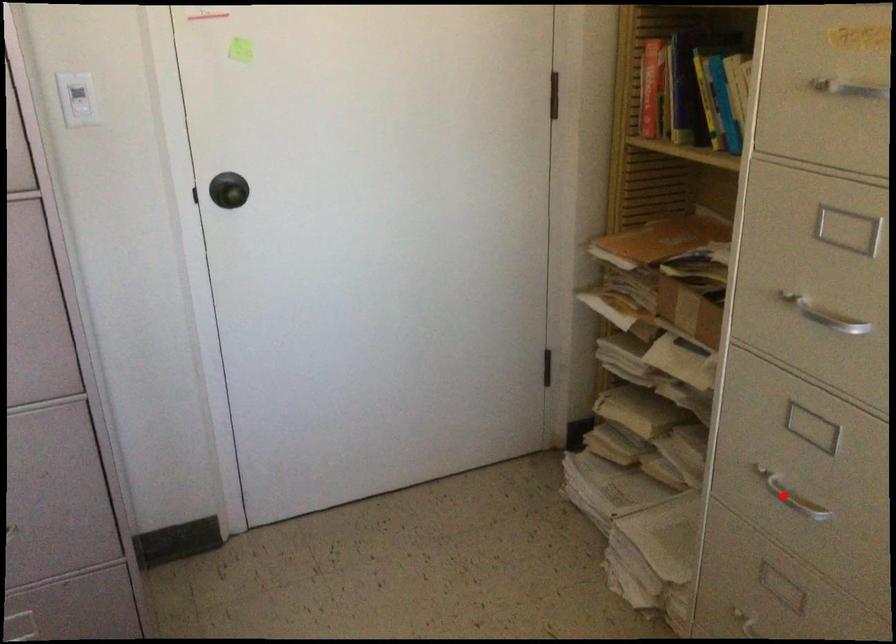
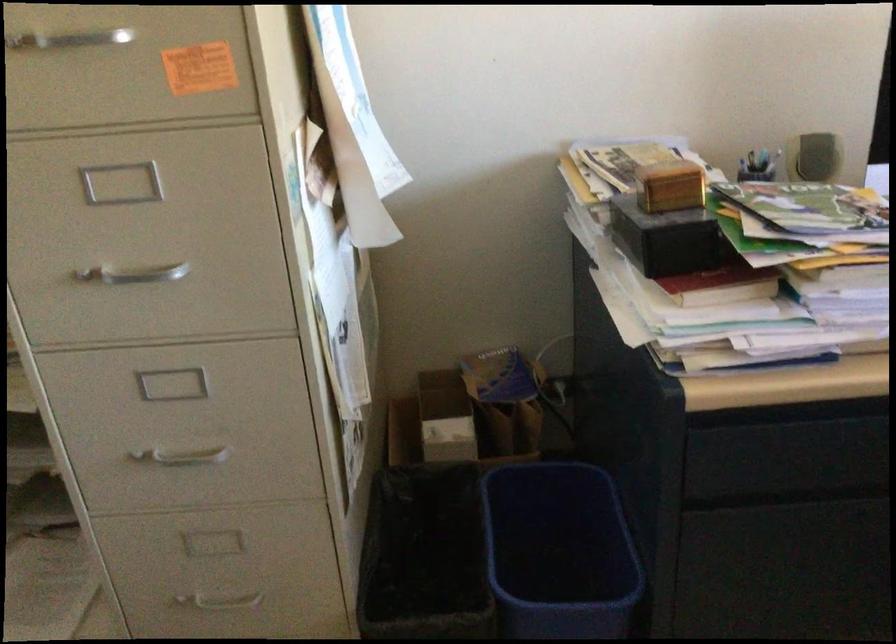
Locate, in the second image, the point that corresponds to the highlighted location in the first image.

(181, 456)